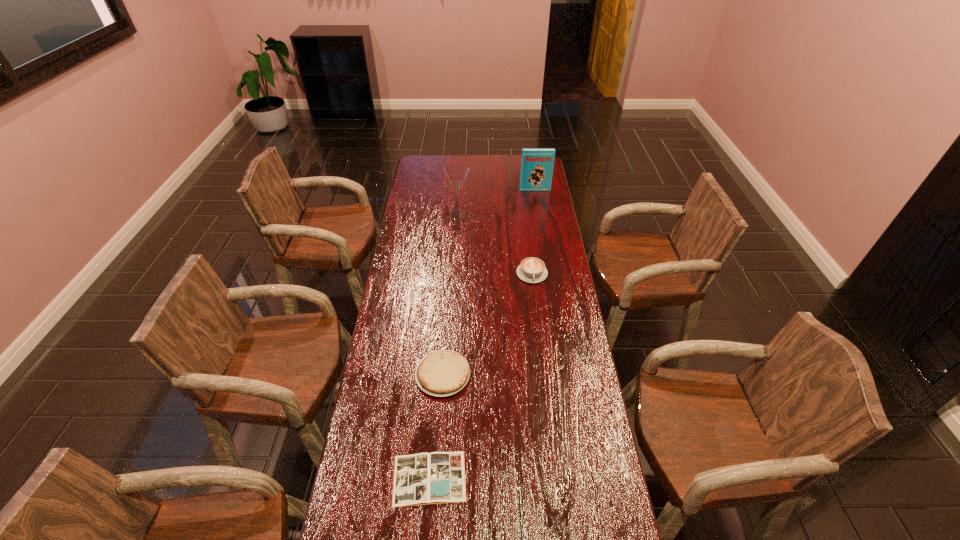
This screenshot has height=540, width=960. Identify the location of empty location between the tortilla and the flute glass. (450, 294).

At what (x,y) coordinates should I click in order to perform the action: click on object that stands as the third closest to the farthest object. Please return your answer as a coordinate pair (x, y). Looking at the image, I should click on (441, 373).

Point out which object is positioned as the fourth nearest to the right book. Please provide its 2D coordinates. Your answer should be formatted as a tuple, i.e. [(x, y)], where the tuple contains the x and y coordinates of a point satisfying the conditions above.

[(438, 477)]

Find the location of a particular element. free spot that satisfies the following two spatial constraints: 1. on the back side of the shorter book; 2. on the left side of the tortilla is located at coordinates (438, 374).

Find the location of a particular element. This screenshot has width=960, height=540. vacant space that satisfies the following two spatial constraints: 1. on the back side of the second farthest object; 2. on the right side of the nearer book is located at coordinates [x=450, y=215].